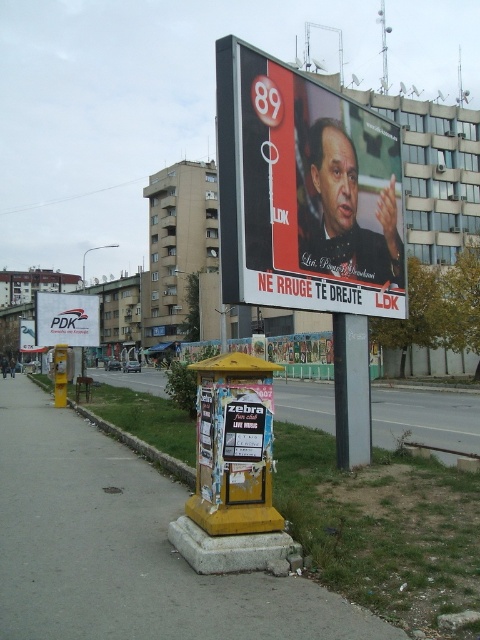
Question: Which point is closer to the camera?

Choices:
 (A) (343, 328)
 (B) (359, 634)

Answer: (B)

Question: Does yellow concrete at center have a larger size compared to metallic pole at center?

Choices:
 (A) no
 (B) yes

Answer: (B)

Question: Which object is closer to the camera taking this photo?

Choices:
 (A) white plastic billboard at center
 (B) yellow concrete at center
 (C) yellow painted concrete at lower center

Answer: (B)

Question: Which point is closer to the camera taking this photo?

Choices:
 (A) (128, 444)
 (B) (359, 435)

Answer: (B)

Question: Observing the image, what is the correct spatial positioning of white plastic billboard at center in reference to green grass at lower left?

Choices:
 (A) above
 (B) below

Answer: (A)

Question: Is yellow painted concrete at lower center thinner than green grass at lower left?

Choices:
 (A) yes
 (B) no

Answer: (B)